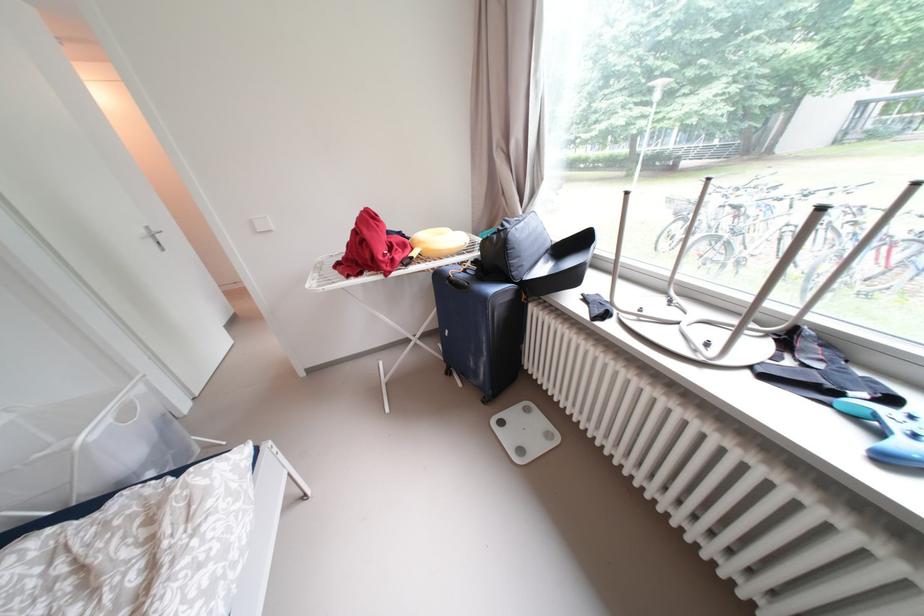
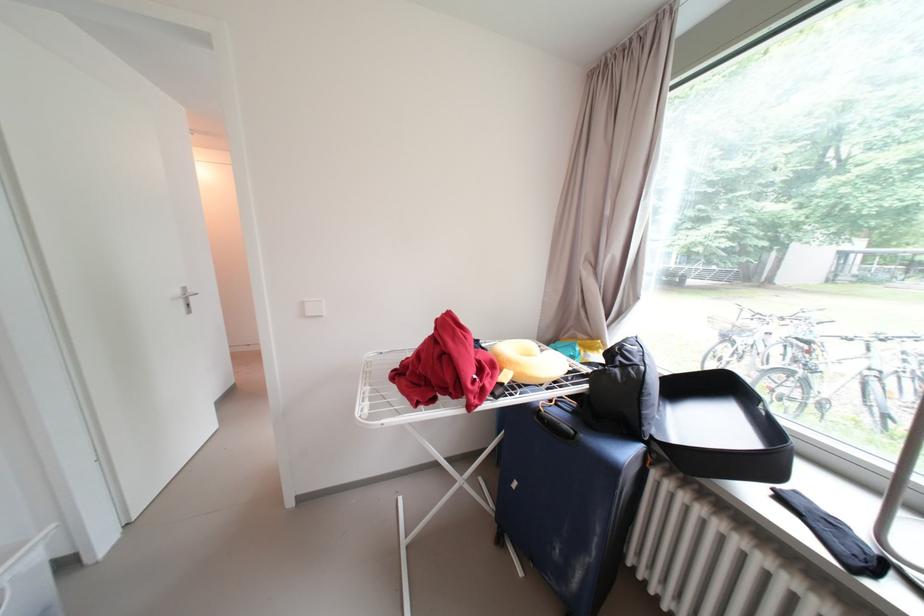
Find the pixel in the second image that matches point 259,223 in the first image.

(310, 305)